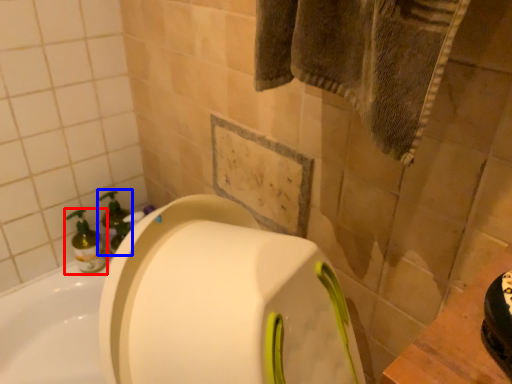
Question: Which point is closer to the camera, cleaning product (highlighted by a red box) or soap dispenser (highlighted by a blue box)?

Choices:
 (A) cleaning product
 (B) soap dispenser

Answer: (A)